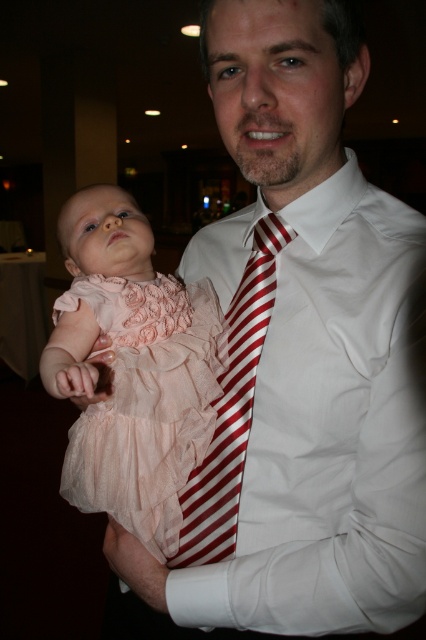
You are a photographer adjusting your camera settings to capture the red striped tie at center and the pink satin dress at left. Which object should you focus on first to ensure both are in sharp focus?

The red striped tie at center is closer to you than the pink satin dress at left, so you should focus on the red striped tie at center first to ensure both are in sharp focus.

You are organizing a baby clothing display. You have two dresses to place on a mannequin. The pale pink chiffon dress at center and the pink satin dress at left. Which dress should you choose if you want the one that is bigger in size?

The pale pink chiffon dress at center is larger in size than the pink satin dress at left, so you should choose the pale pink chiffon dress at center for the mannequin if you want the bigger size.

You are organizing a photo shoot and need to ensure that the pale pink chiffon dress at center and the red striped tie at center fit within a rectangular frame. Which object requires more horizontal space to be fully captured in the frame?

The pale pink chiffon dress at center might be wider than the red striped tie at center, so it requires more horizontal space to be fully captured in the frame.